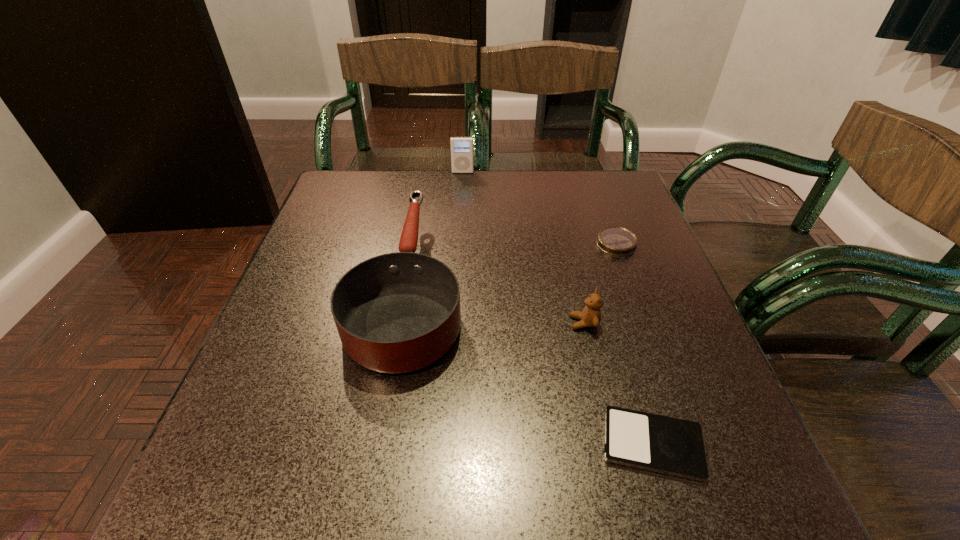
Locate an element on the screen. The height and width of the screenshot is (540, 960). iPod that is at the right edge is located at coordinates (657, 443).

Locate an element on the screen. object situated at the near right corner is located at coordinates (657, 443).

In the image, there is a desktop. Identify the location of vacant space at the far edge. This screenshot has width=960, height=540. (447, 194).

The image size is (960, 540). In order to click on free space at the left edge of the desktop in this screenshot , I will do `click(374, 229)`.

Identify the location of vacant area at the right edge of the desktop. Image resolution: width=960 pixels, height=540 pixels. (700, 385).

Find the location of a particular element. The width and height of the screenshot is (960, 540). vacant space at the far left corner of the desktop is located at coordinates (364, 172).

What are the coordinates of `free space at the far right corner` in the screenshot? It's located at (624, 178).

In order to click on unoccupied area between the nearer iPod and the teddy bear in this screenshot , I will do `click(618, 383)`.

You are a GUI agent. You are given a task and a screenshot of the screen. Output one action in this format:
    pyautogui.click(x=<x>, y=<y>)
    Task: Click on the free space that is in between the farthest object and the compass
    The width and height of the screenshot is (960, 540).
    Given the screenshot: What is the action you would take?
    pyautogui.click(x=540, y=208)

Where is `blank region between the pan and the nearest object`? This screenshot has width=960, height=540. blank region between the pan and the nearest object is located at coordinates (531, 364).